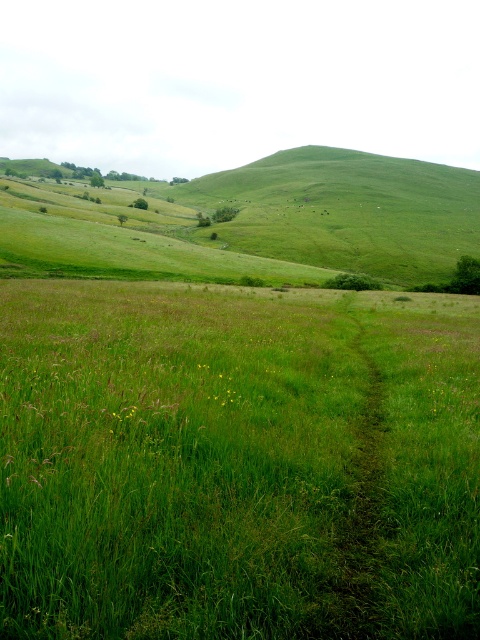
Is green grassy field at center positioned in front of green grassy trail at center?

That is True.

Does green grassy field at center have a smaller size compared to green grassy trail at center?

No.

Where is `green grassy field at center`? The width and height of the screenshot is (480, 640). green grassy field at center is located at coordinates (235, 467).